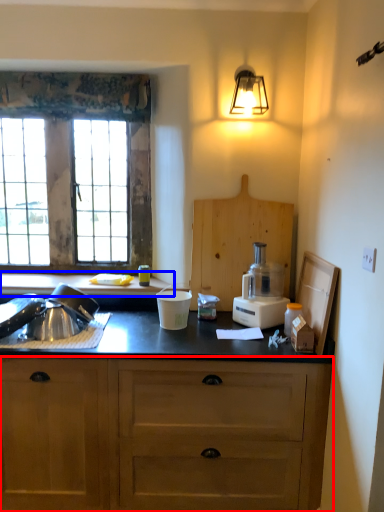
Question: Which point is further to the camera, cabinetry (highlighted by a red box) or countertop (highlighted by a blue box)?

Choices:
 (A) cabinetry
 (B) countertop

Answer: (B)